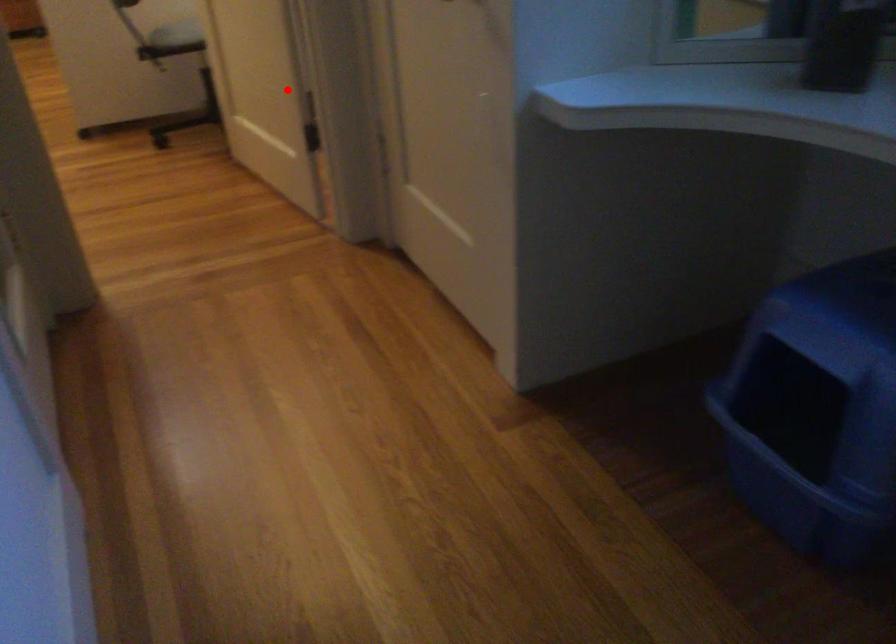
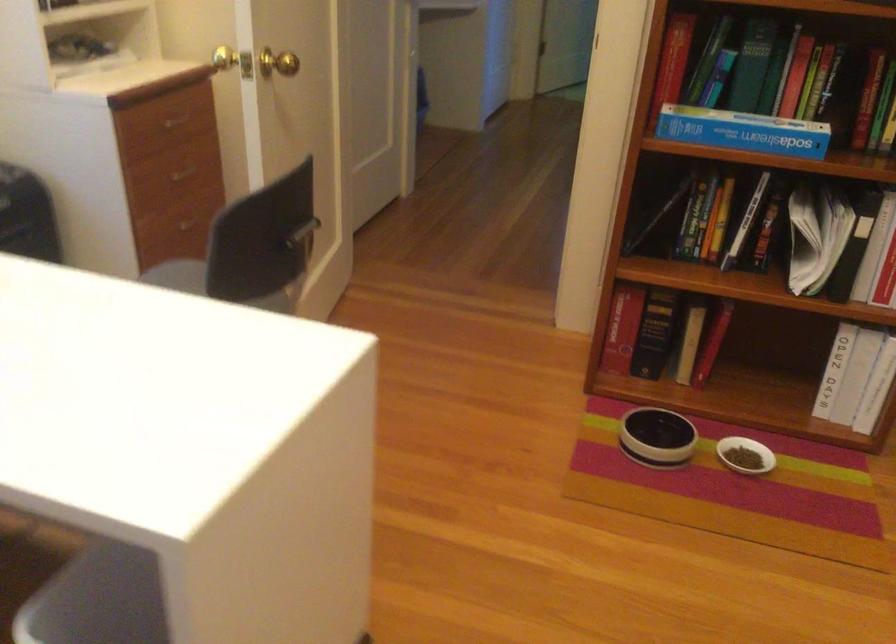
Find the pixel in the second image that matches the highlighted location in the first image.

(304, 232)